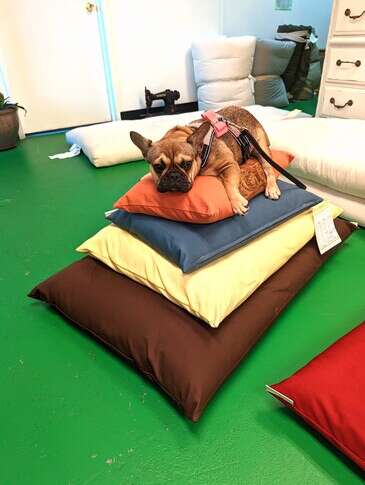
Find the location of a particular element. The height and width of the screenshot is (485, 365). flower pot is located at coordinates click(x=11, y=132).